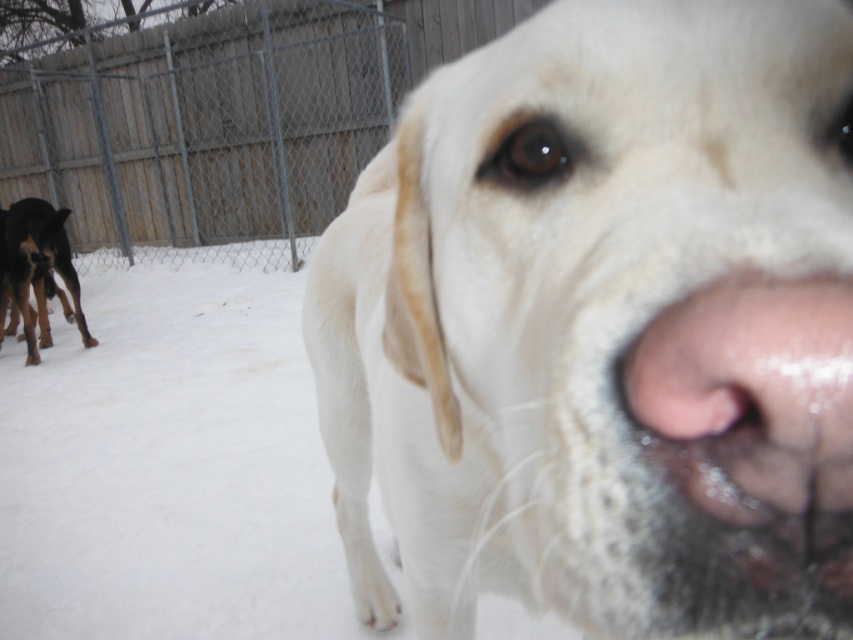
You are a photographer trying to focus on two points in the image. The first point is point (503,42) and the second is point (65,250). Which point is in the foreground?

Point (503,42) is closer to the camera than point (65,250), so it is in the foreground.